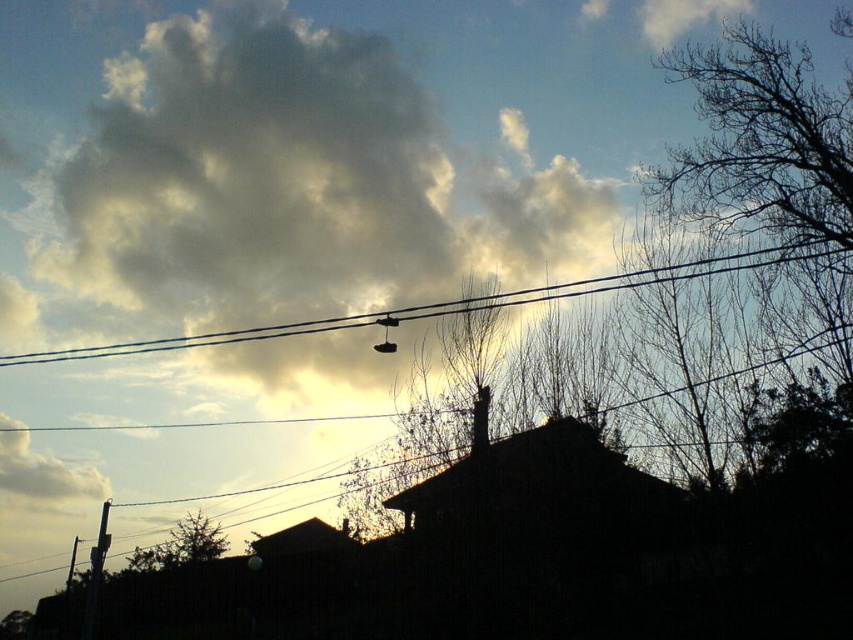
You are standing in the suburban scene and want to place a small garden ornament. You have two options for placement based on the coordinates given. Which point, point (450, 301) or point (16, 456), is closer to where you are standing?

Point (450, 301) is closer to the camera than point (16, 456), so placing the ornament there would be closer to your current position.

Based on the photo, you are a drone operator planning to fly a drone from the black wire at center to the white fluffy cloud at upper left. Given that your drone can only fly up to 25 meters, will it be able to reach the cloud?

The distance between the black wire at center and the white fluffy cloud at upper left is 27.37 meters, which exceeds the drone maximum range of 25 meters. Therefore, the drone cannot reach the cloud.

You are a bird flying over the suburban area shown in the image. You want to land on the highest point between the black wire at center and the white fluffy cloud at upper left. Which one should you choose?

The black wire at center has a greater height compared to the white fluffy cloud at upper left, so you should choose the black wire at center to land on the highest point.